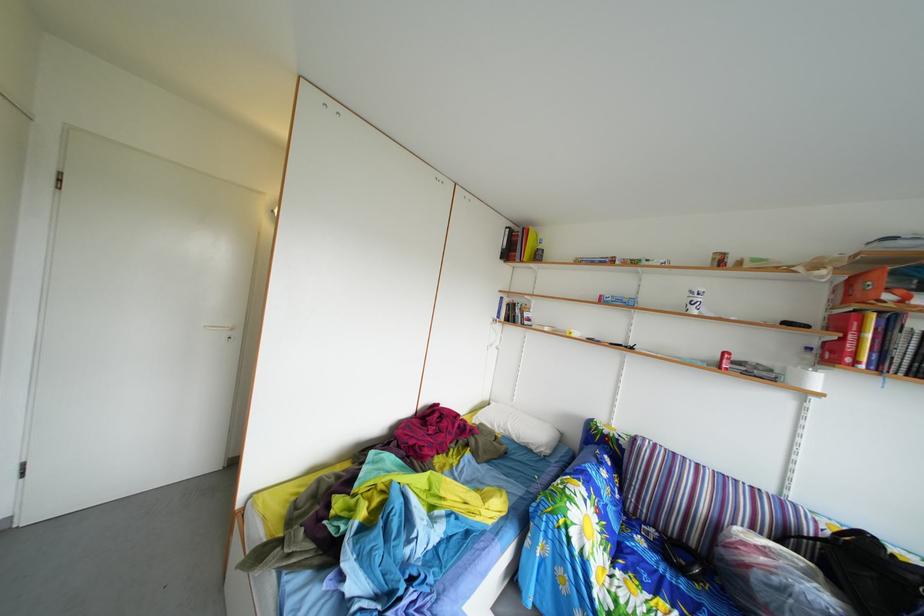
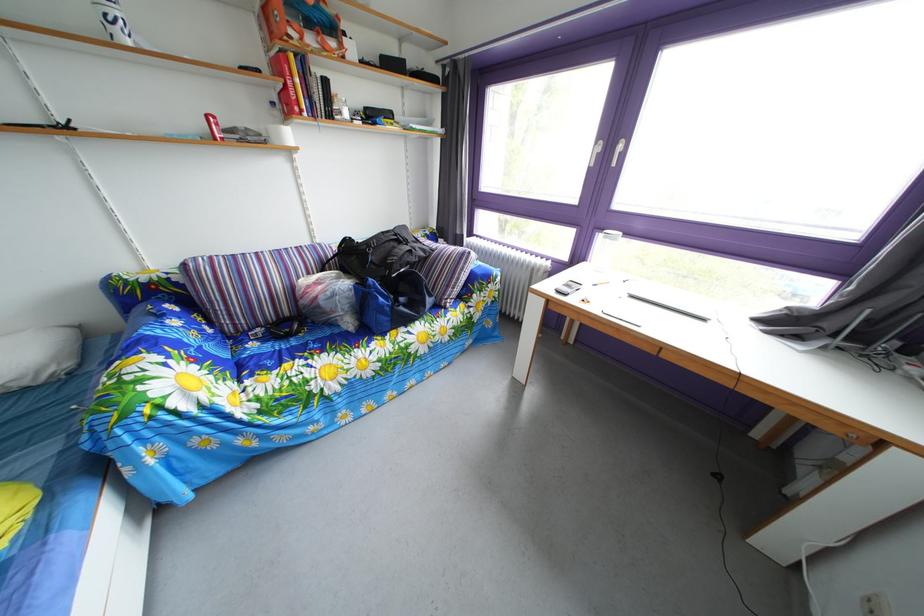
Find the pixel in the second image that matches point (546, 442) in the first image.

(18, 370)